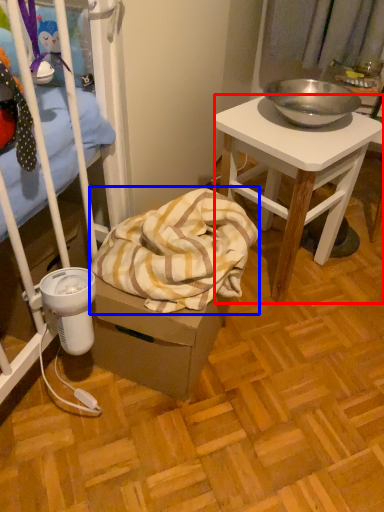
Question: Which object appears farthest to the camera in this image, desk (highlighted by a red box) or blanket (highlighted by a blue box)?

Choices:
 (A) desk
 (B) blanket

Answer: (A)